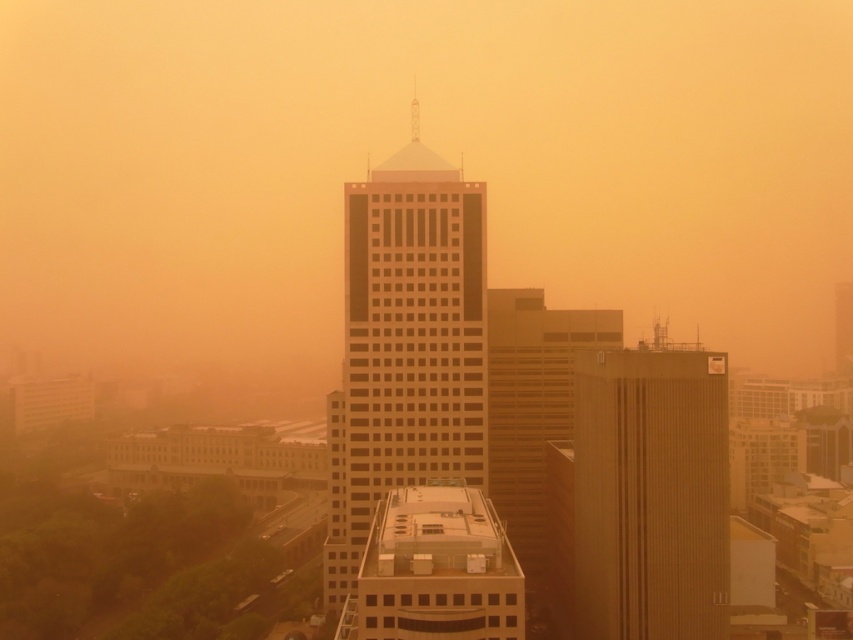
You are a city planner analyzing the cityscape. You need to determine which building is wider between the matte glass skyscraper at center and the brown textured building at center. Based on the scene, which one is wider?

The matte glass skyscraper at center is wider than the brown textured building at center according to the description.

You are a drone operator trying to navigate through the city. You see the matte orange haze at center and the matte glass skyscraper at center. Which object is taller from your viewpoint?

The matte orange haze at center is taller than the matte glass skyscraper at center.